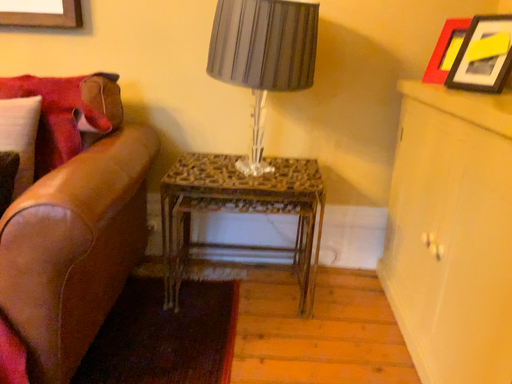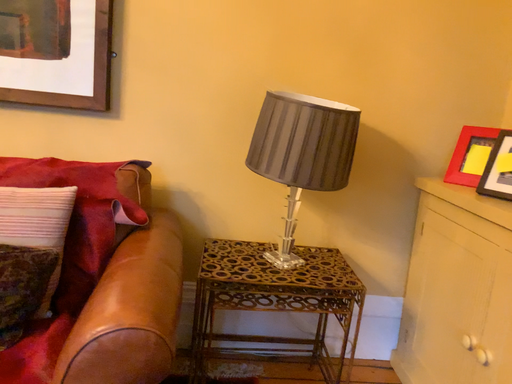
Question: Which way did the camera rotate in the video?

Choices:
 (A) rotated downward
 (B) rotated upward

Answer: (B)